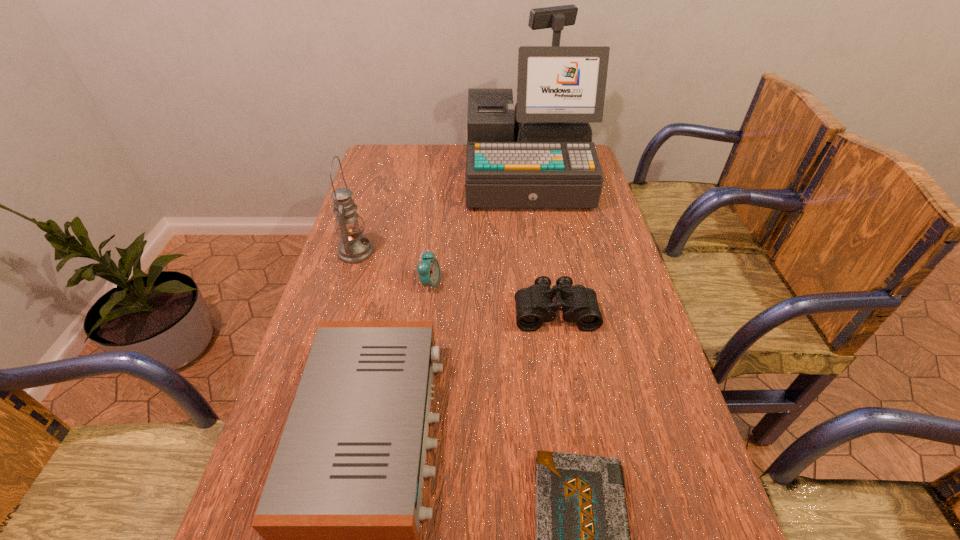
The image size is (960, 540). What are the coordinates of `the tallest object` in the screenshot? It's located at (540, 154).

Identify the location of the farthest object. The image size is (960, 540). (540, 154).

Find the location of a particular element. The width and height of the screenshot is (960, 540). oil lamp is located at coordinates (353, 248).

This screenshot has height=540, width=960. Find the location of `the second tallest object`. the second tallest object is located at coordinates (353, 248).

The height and width of the screenshot is (540, 960). Find the location of `alarm clock`. alarm clock is located at coordinates (428, 268).

This screenshot has height=540, width=960. What are the coordinates of `the fifth tallest object` in the screenshot? It's located at (534, 305).

The width and height of the screenshot is (960, 540). What are the coordinates of `vacant space situated 0.330m on the customer-facing side of the cash register` in the screenshot? It's located at (542, 284).

Locate an element on the screen. The width and height of the screenshot is (960, 540). free space located on the back of the second tallest object is located at coordinates (368, 214).

Find the location of a particular element. blank area located 0.390m on the face of the alarm clock is located at coordinates (584, 285).

Identify the location of vacant space located at the eyepieces of the second shortest object. (578, 451).